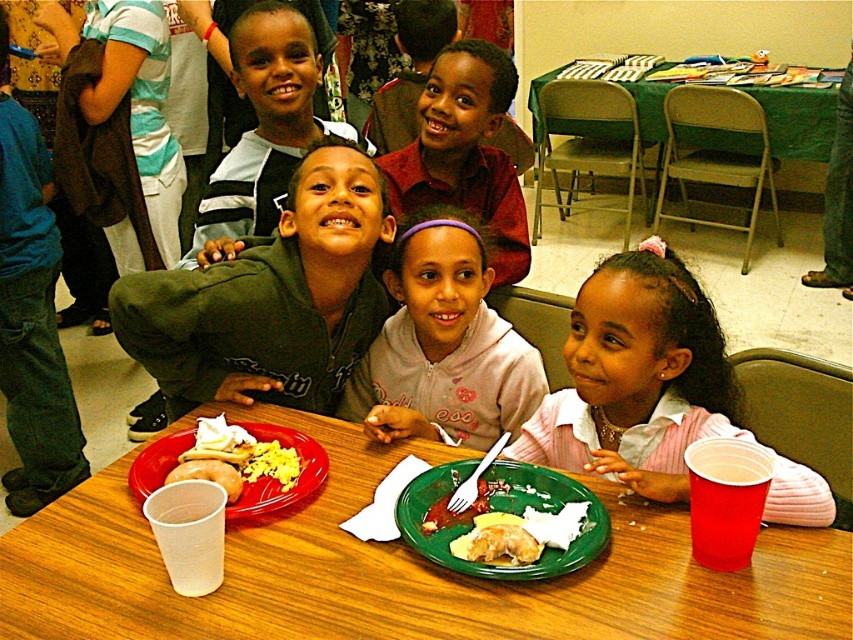
Question: Which point appears closest to the camera in this image?

Choices:
 (A) (289, 54)
 (B) (457, 346)
 (C) (196, 476)
 (D) (648, 348)

Answer: (D)

Question: Can you confirm if matte green jacket at center is positioned to the left of yellowish matte bread at center?

Choices:
 (A) no
 (B) yes

Answer: (B)

Question: Which object appears closest to the camera in this image?

Choices:
 (A) wooden table at center
 (B) yellowish matte bread at center
 (C) white plastic cup at lower left
 (D) matte green jacket at center

Answer: (A)

Question: Can you confirm if wooden table at center is positioned below yellow scrambled eggs at center?

Choices:
 (A) no
 (B) yes

Answer: (B)

Question: Is wooden table at center positioned at the back of pink fabric shirt at center?

Choices:
 (A) no
 (B) yes

Answer: (A)

Question: Among these objects, which one is farthest from the camera?

Choices:
 (A) yellow scrambled eggs at center
 (B) wooden table at center

Answer: (A)